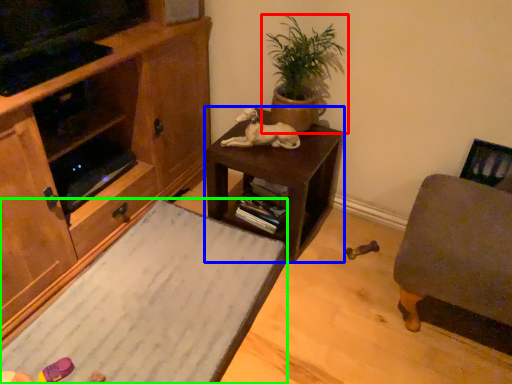
Question: Which object is the farthest from houseplant (highlighted by a red box)? Choose among these: table (highlighted by a blue box) or desk (highlighted by a green box).

Choices:
 (A) table
 (B) desk

Answer: (B)